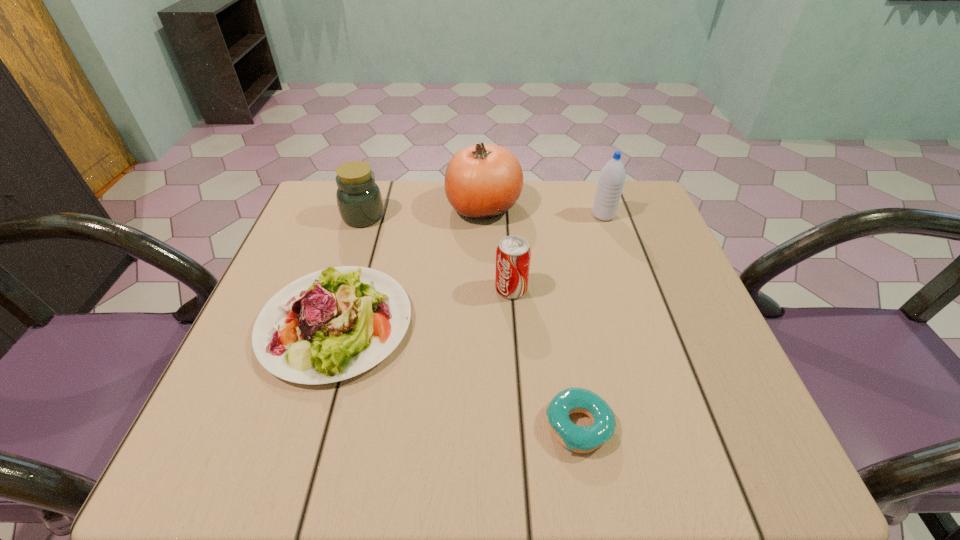
Image resolution: width=960 pixels, height=540 pixels. Identify the location of free space that satisfies the following two spatial constraints: 1. on the back side of the doughnut; 2. on the right side of the rightmost object. (542, 215).